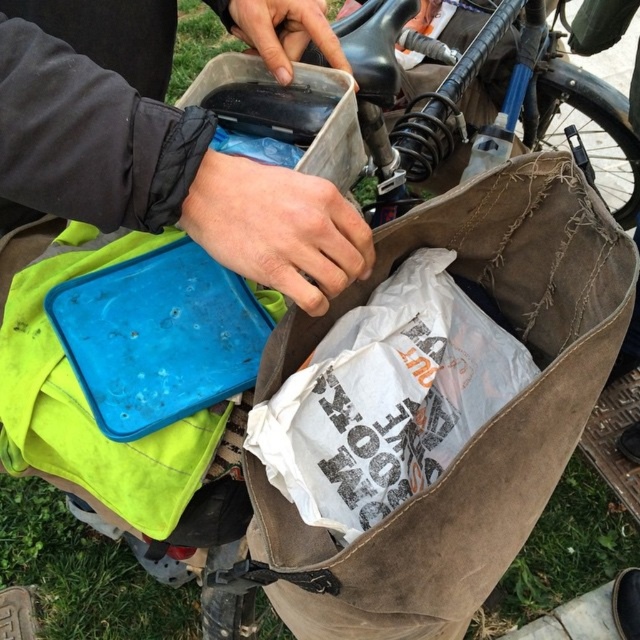
Is brown canvas bag at center to the right of matte plastic container at upper center from the viewer's perspective?

Correct, you'll find brown canvas bag at center to the right of matte plastic container at upper center.

Is brown canvas bag at center shorter than matte plastic container at upper center?

No, brown canvas bag at center is not shorter than matte plastic container at upper center.

The image size is (640, 640). What do you see at coordinates (481, 429) in the screenshot? I see `brown canvas bag at center` at bounding box center [481, 429].

In order to click on brown canvas bag at center in this screenshot , I will do click(481, 429).